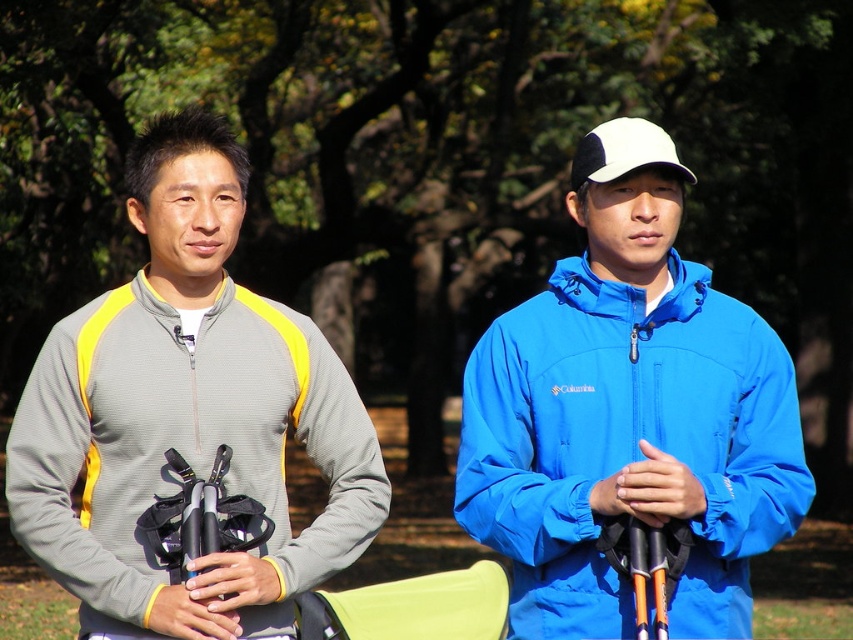
You are a photographer trying to capture both the blue matte jacket at center and the gray fleece jacket at left in a single frame. Given their sizes, which jacket might require you to step back to include its full view?

The gray fleece jacket at left has a greater width than the blue matte jacket at center, so you might need to step back to capture the full view of the gray fleece jacket at left.

You are a photographer trying to capture both the blue matte jacket at center and the gray fleece jacket at left in the same frame. Based on their heights, which jacket will appear larger in the photo?

The gray fleece jacket at left appears larger in the photo because it is taller than the blue matte jacket at center.